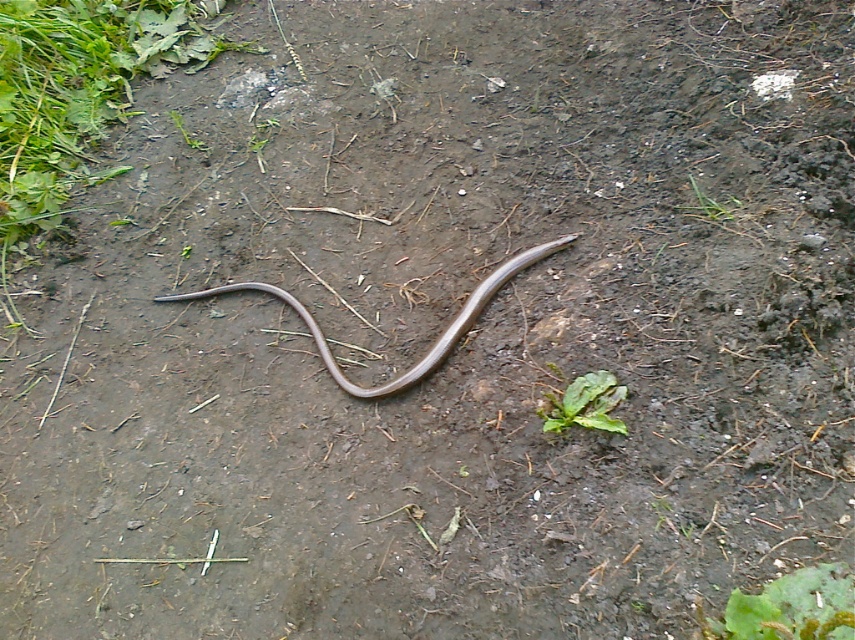
You are a gardener examining the soil in the center of the image. You notice the brown matte snake at center and the green leafy plant at center. Which object is taller?

The brown matte snake at center is taller than the green leafy plant at center.

You are a gardener holding a 12 inch long tool. You need to reach the green leafy plant at center without touching the brown matte snake at center. Is your tool long enough to do so?

The distance between the brown matte snake at center and the green leafy plant at center is 16.40 inches. Since your tool is only 12 inches long, it is not long enough to reach the green leafy plant at center without touching the snake.

You are a gardener who wants to place a small decorative stone between the brown matte snake at center and the green leafy plant at center. Considering their sizes, which object should you place the stone closer to to ensure it fits comfortably without overlapping?

The brown matte snake at center is wider than the green leafy plant at center. Therefore, you should place the stone closer to the narrower green leafy plant at center to ensure it fits comfortably without overlapping.